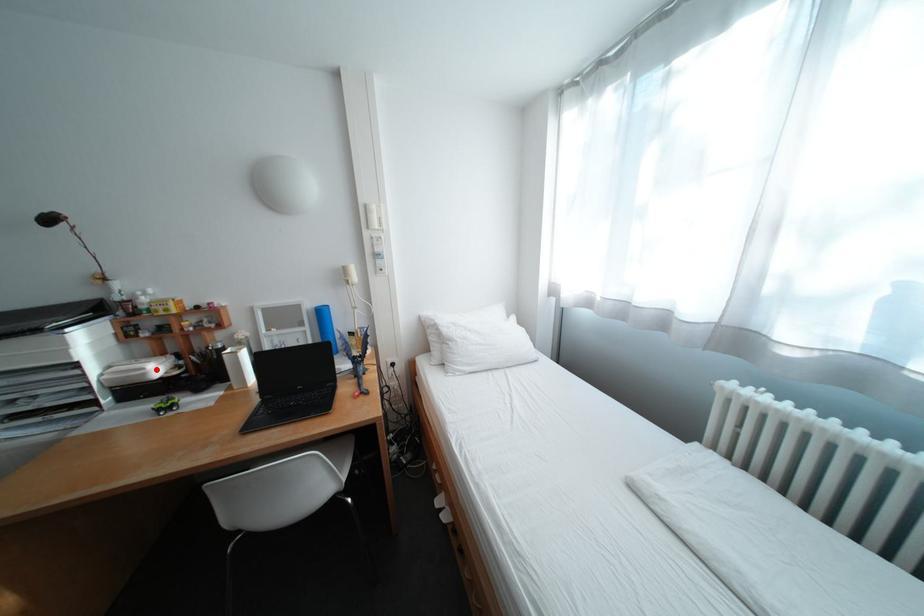
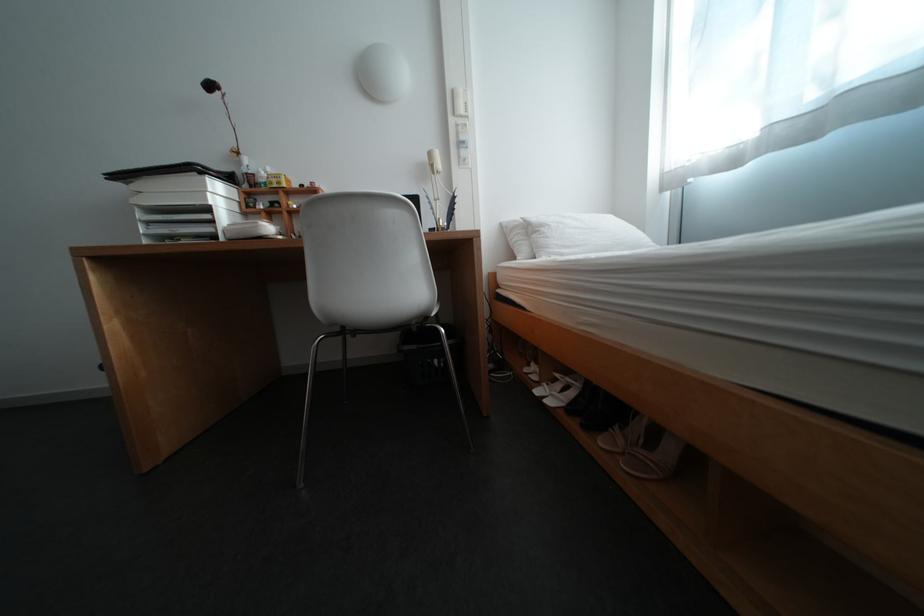
Where in the second image is the point corresponding to the highlighted location from the first image?

(270, 224)